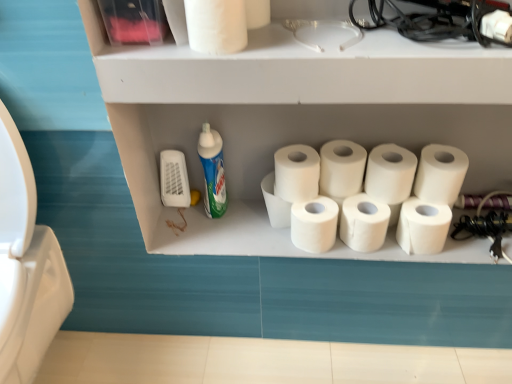
What are the coordinates of `empty space that is ontop of white matte shelf at upper center (from a real-world perspective)` in the screenshot? It's located at (376, 18).